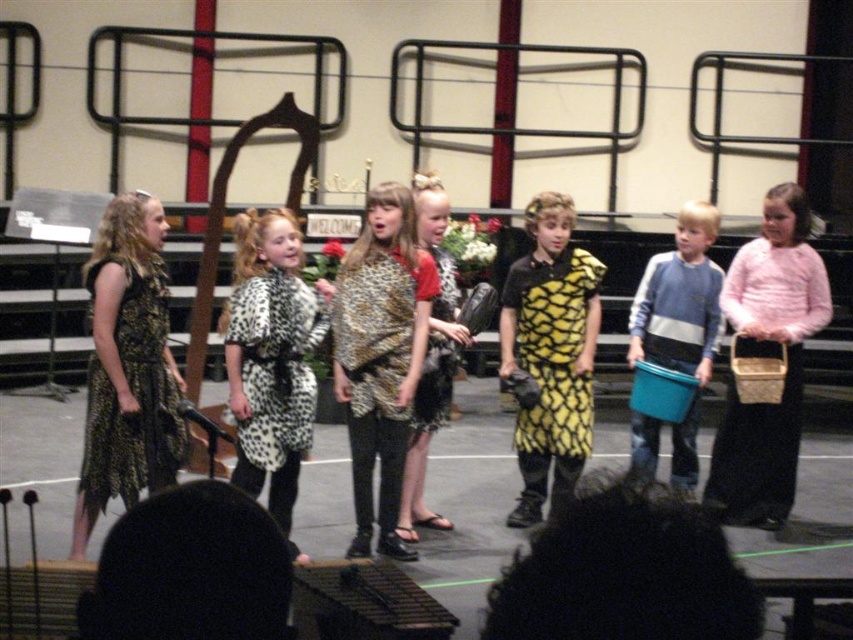
Question: Which point is closer to the camera taking this photo?

Choices:
 (A) (453, 282)
 (B) (746, 344)
 (C) (703, 212)
 (D) (424, 365)

Answer: (D)

Question: Which is nearer to the pink wool sweater at right?

Choices:
 (A) leopard print fabric dress at left
 (B) leopard print fabric dress at center

Answer: (B)

Question: Is yellow leopard print dress at center to the right of leopard print fabric dress at center from the viewer's perspective?

Choices:
 (A) no
 (B) yes

Answer: (B)

Question: Which point is farther to the camera?

Choices:
 (A) (148, 321)
 (B) (793, 456)

Answer: (B)

Question: Is the position of pink wool sweater at right more distant than that of yellow leopard print dress at center?

Choices:
 (A) yes
 (B) no

Answer: (B)

Question: Does leopard print fabric dress at left appear on the left side of blue plastic bucket at center?

Choices:
 (A) yes
 (B) no

Answer: (A)